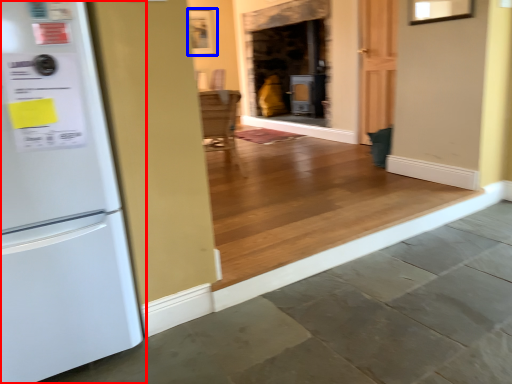
Question: Which object appears closest to the camera in this image, refrigerator (highlighted by a red box) or picture frame (highlighted by a blue box)?

Choices:
 (A) refrigerator
 (B) picture frame

Answer: (A)